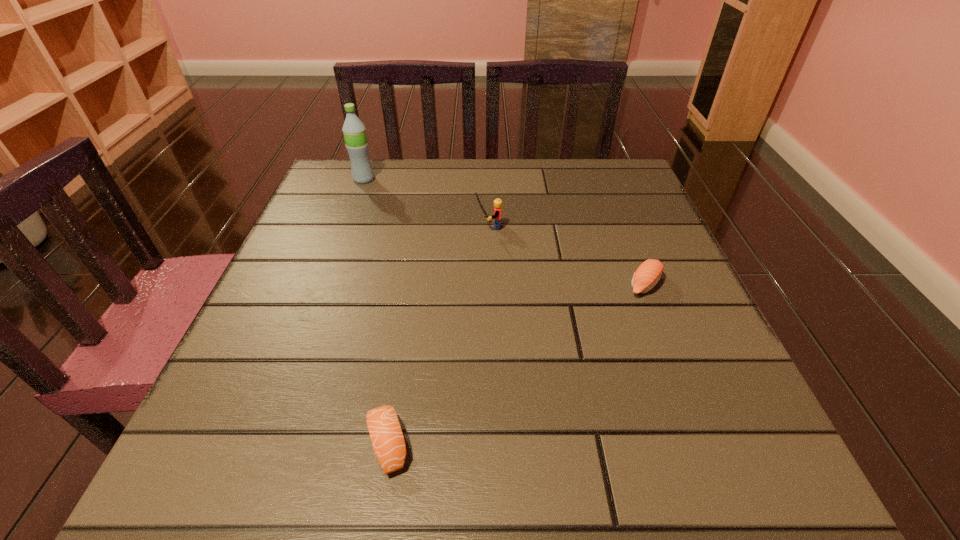
The width and height of the screenshot is (960, 540). I want to click on vacant space that's between the farther sushi and the nearest object, so click(516, 364).

The image size is (960, 540). I want to click on vacant area that lies between the water bottle and the second tallest object, so click(426, 203).

This screenshot has height=540, width=960. Identify the location of free space between the third object from left to right and the shorter sushi. (438, 335).

This screenshot has height=540, width=960. I want to click on free spot between the rightmost object and the shortest object, so click(x=516, y=364).

Where is `object that stands as the second closest to the farther sushi`? The height and width of the screenshot is (540, 960). object that stands as the second closest to the farther sushi is located at coordinates (389, 446).

Where is `object that is the second nearest to the leftmost object`? The width and height of the screenshot is (960, 540). object that is the second nearest to the leftmost object is located at coordinates (647, 275).

The image size is (960, 540). Identify the location of free space that satisfies the following two spatial constraints: 1. on the front-facing side of the second shortest object; 2. on the right side of the third shortest object. (490, 285).

At what (x,y) coordinates should I click in order to perform the action: click on blank area in the image that satisfies the following two spatial constraints: 1. on the front side of the left sushi; 2. on the right side of the tallest object. Please return your answer as a coordinate pair (x, y). Looking at the image, I should click on (266, 443).

At what (x,y) coordinates should I click in order to perform the action: click on vacant space that satisfies the following two spatial constraints: 1. on the front-facing side of the Lego; 2. on the back side of the taller sushi. Please return your answer as a coordinate pair (x, y). Looking at the image, I should click on (490, 285).

Where is `vacant area in the image that satisfies the following two spatial constraints: 1. on the front-facing side of the Lego; 2. on the front side of the shorter sushi`? vacant area in the image that satisfies the following two spatial constraints: 1. on the front-facing side of the Lego; 2. on the front side of the shorter sushi is located at coordinates (493, 443).